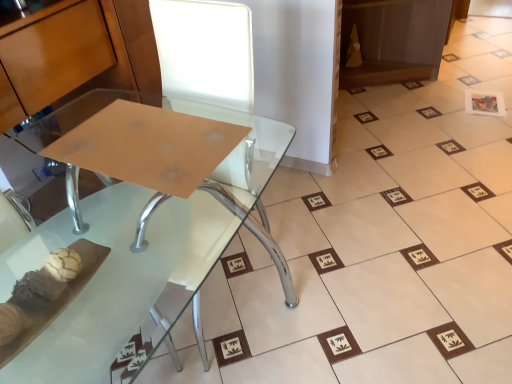
Identify the location of vacant space behind white paper at upper right. (469, 86).